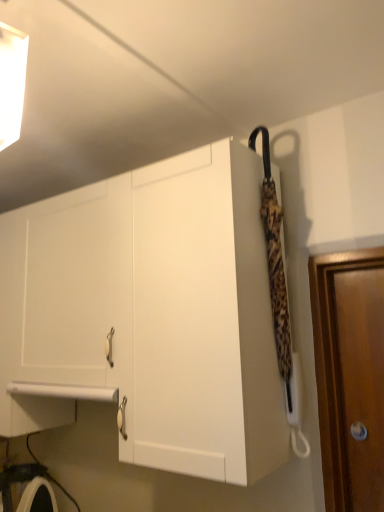
I want to click on white glossy light fixture at upper left, so click(x=12, y=82).

Image resolution: width=384 pixels, height=512 pixels. What do you see at coordinates (12, 82) in the screenshot?
I see `white glossy light fixture at upper left` at bounding box center [12, 82].

The image size is (384, 512). What are the coordinates of `white glossy light fixture at upper left` in the screenshot? It's located at (12, 82).